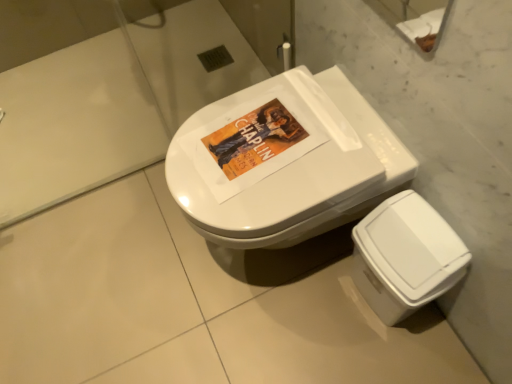
What are the coordinates of `free point above white glossy toilet at center (from a real-world perspective)` in the screenshot? It's located at (257, 142).